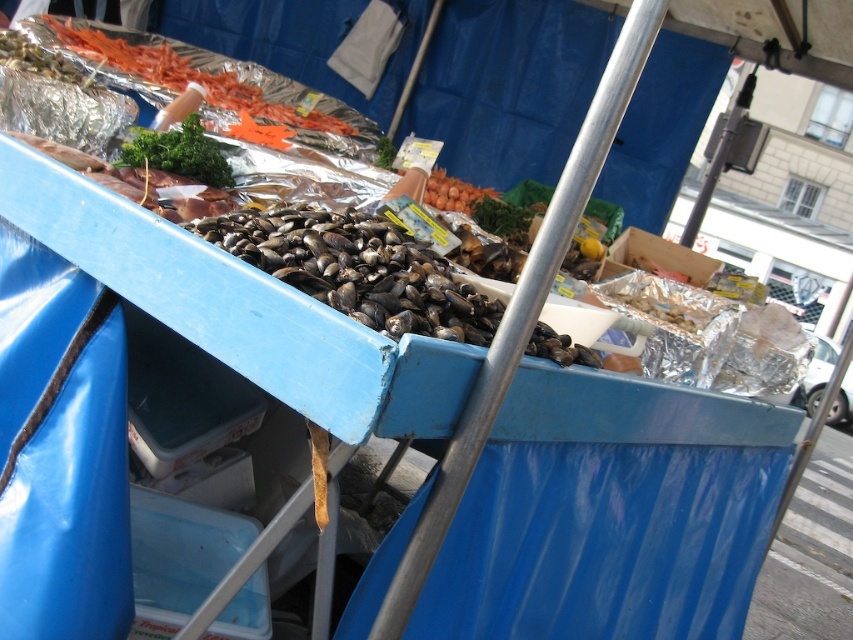
Question: Which point is closer to the camera taking this photo?

Choices:
 (A) pyautogui.click(x=346, y=273)
 (B) pyautogui.click(x=163, y=163)

Answer: (A)

Question: Which point appears farthest from the camera in this image?

Choices:
 (A) (196, 115)
 (B) (303, 291)

Answer: (A)

Question: In this image, where is shiny dark shells at center located relative to green leafymaterial/texturevegetable at upper left?

Choices:
 (A) below
 (B) above

Answer: (A)

Question: Can you confirm if shiny dark shells at center is smaller than green leafymaterial/texturevegetable at upper left?

Choices:
 (A) yes
 (B) no

Answer: (B)

Question: Is shiny dark shells at center to the left of green leafymaterial/texturevegetable at upper left from the viewer's perspective?

Choices:
 (A) yes
 (B) no

Answer: (B)